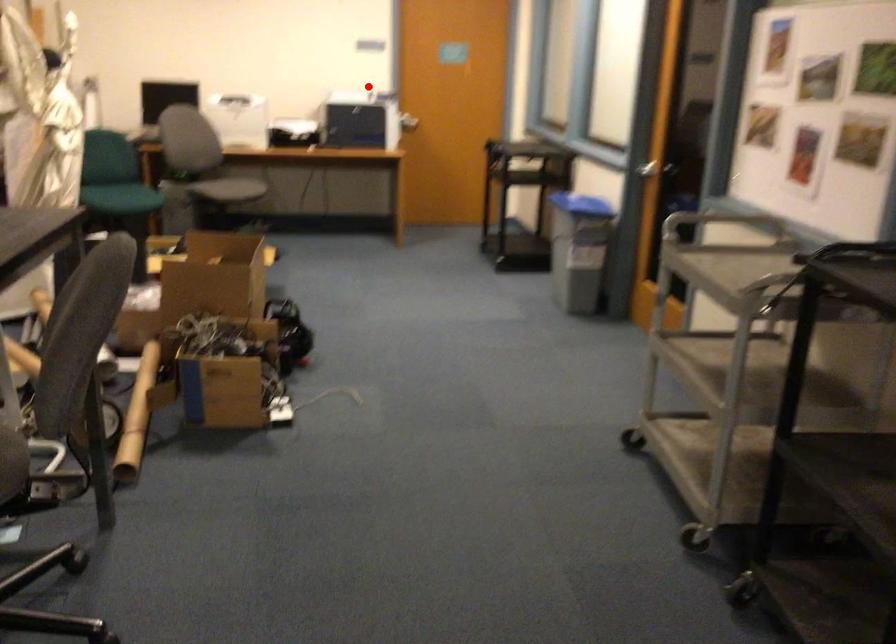
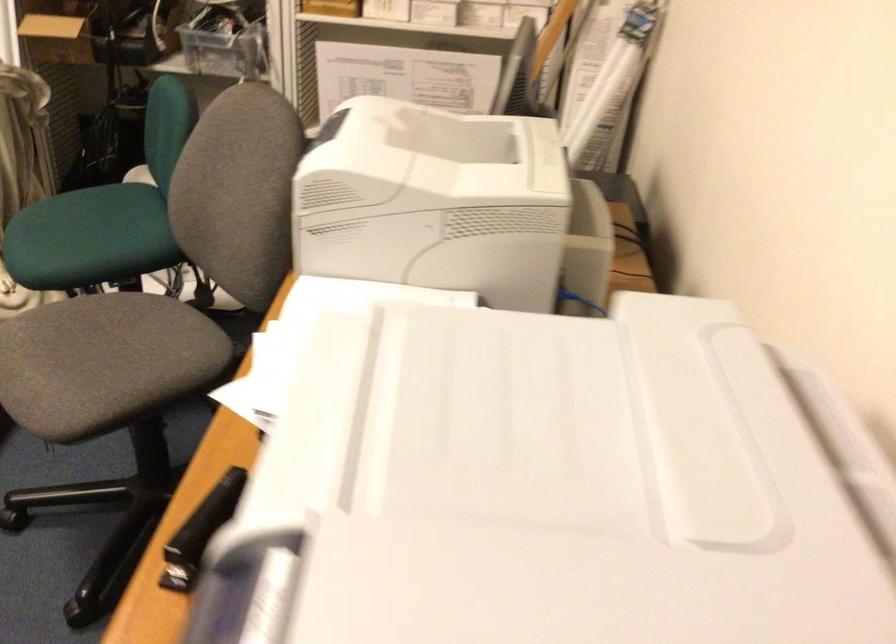
Find the pixel in the second image that matches the highlighted location in the first image.

(593, 491)